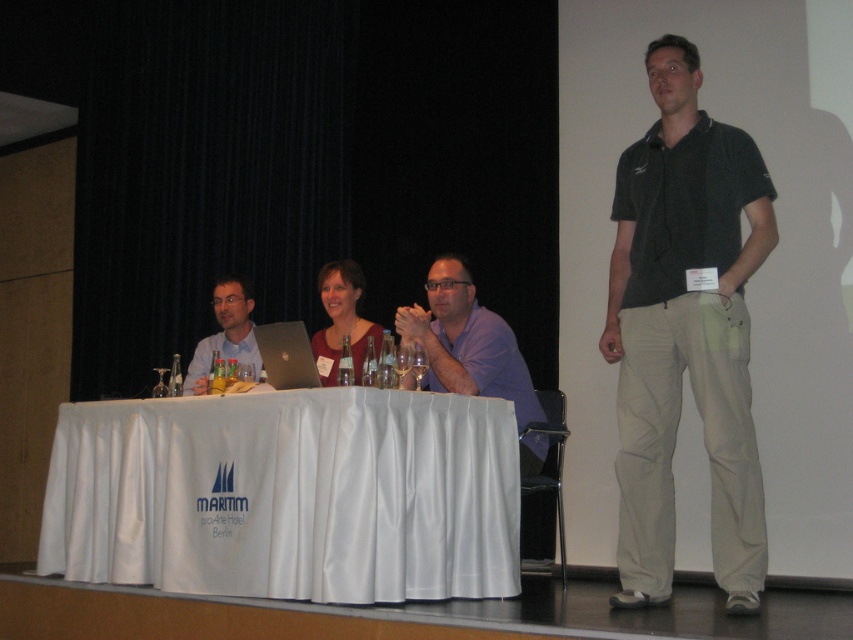
Question: Which point appears farthest from the camera in this image?

Choices:
 (A) (621, 225)
 (B) (264, 358)

Answer: (B)

Question: Can you confirm if purple cotton shirt at center is positioned below silver metallic laptop at center?

Choices:
 (A) yes
 (B) no

Answer: (A)

Question: Can you confirm if purple cotton shirt at center is wider than silver metallic laptop at center?

Choices:
 (A) yes
 (B) no

Answer: (A)

Question: From the image, what is the correct spatial relationship of dark green polo shirt at center in relation to matte purple shirt at center?

Choices:
 (A) left
 (B) right

Answer: (B)

Question: Which object is closer to the camera taking this photo?

Choices:
 (A) dark green polo shirt at center
 (B) matte purple shirt at center

Answer: (A)

Question: Which of the following is the farthest from the observer?

Choices:
 (A) matte purple shirt at center
 (B) dark green polo shirt at center
 (C) white satin table at center

Answer: (A)